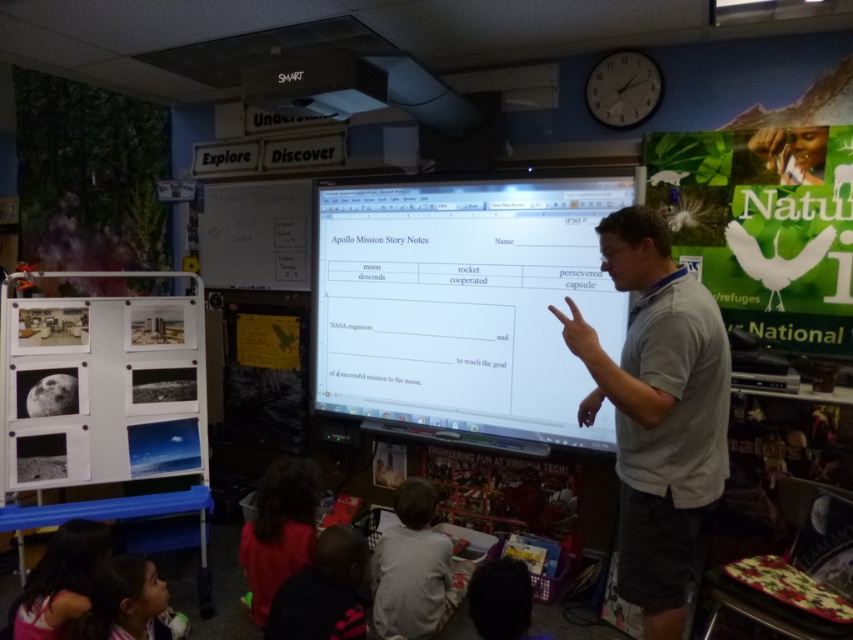
Question: Does gray fabric shirt at lower center have a smaller size compared to dark blue sweater at lower left?

Choices:
 (A) no
 (B) yes

Answer: (B)

Question: Which of the following is the closest to the observer?

Choices:
 (A) white matte dry erase board at upper left
 (B) gray fabric shirt at lower center
 (C) white glossy computer screen at center

Answer: (B)

Question: Considering the real-world distances, which object is closest to the red fabric shirt at lower left?

Choices:
 (A) gray fabric shirt at lower center
 (B) white matte dry erase board at upper left
 (C) green paper poster at right

Answer: (A)

Question: Is gray fabric shirt at lower center thinner than smooth skin face at lower left?

Choices:
 (A) yes
 (B) no

Answer: (B)

Question: Among these objects, which one is farthest from the camera?

Choices:
 (A) gray cotton shirt at upper right
 (B) red fabric shirt at lower left
 (C) dark blue sweater at lower left
 (D) white glossy computer screen at center

Answer: (D)

Question: Does gray fabric shirt at lower center appear under dark blue sweater at lower left?

Choices:
 (A) yes
 (B) no

Answer: (A)